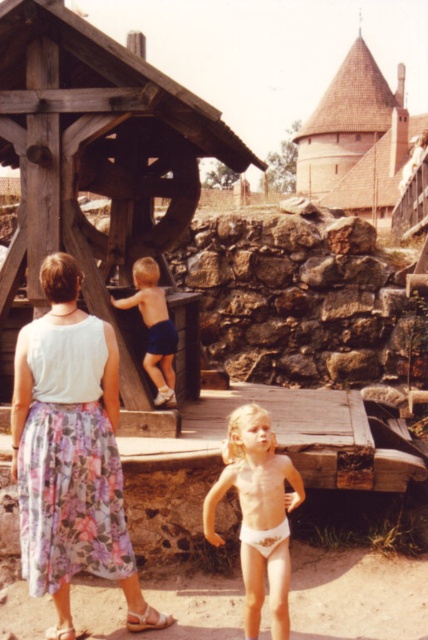
You are a photographer trying to capture a candid shot of the tan skin child at center and the blue denim shorts at center. To ensure both are in focus, you need to know their relative sizes. Which object is wider?

The tan skin child at center is wider than the blue denim shorts at center.

Looking at this image, you are a tour guide leading a group to the wooden gazebo at center. A tourist wearing a floral skirt at center is standing in your path. Can your group walk around them to reach the gazebo?

The distance between the wooden gazebo at center and the floral skirt at center is 2.48 meters. Since the tourist is blocking the path, your group would need to detour around them. However, with only 2.48 meters between the gazebo and the tourist, there might not be enough space to maneuver around comfortably. It is advisable to ask the tourist to step aside or choose an alternative route.